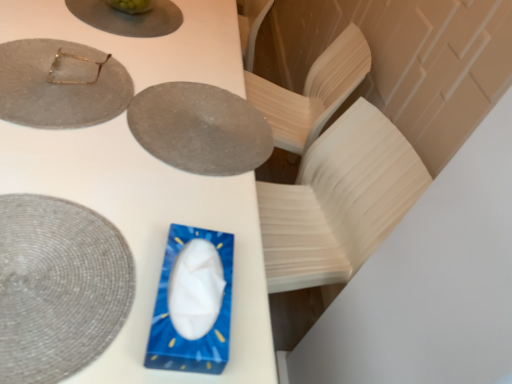
This screenshot has width=512, height=384. In order to click on free space between matte gray plate at upper center, placed as the third plate when sorted from top to bottom, and matte gray plate at upper center, positioned as the 1th plate in top-to-bottom order in this screenshot , I will do `click(169, 52)`.